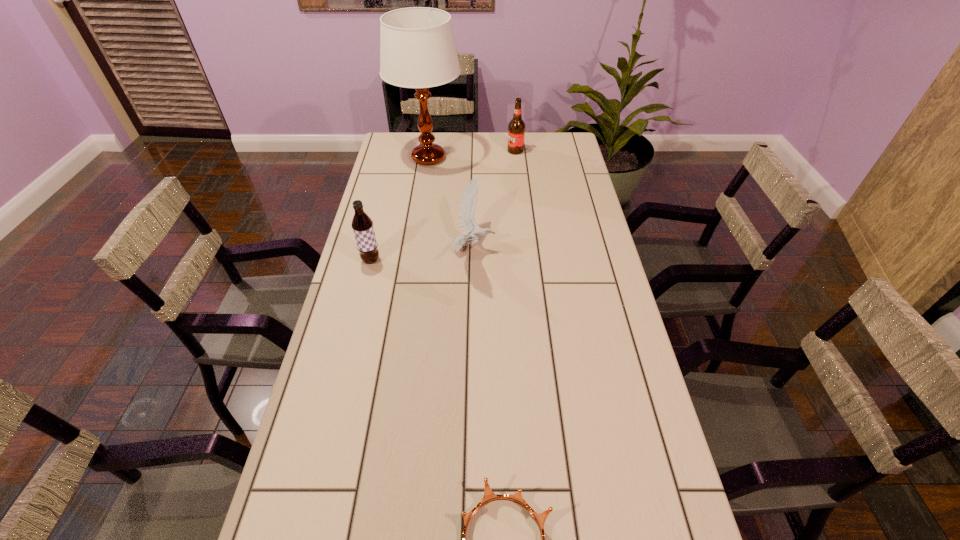
Where is `table lamp`? This screenshot has width=960, height=540. table lamp is located at coordinates (417, 47).

Identify the location of the nearer root beer. This screenshot has width=960, height=540. (x=362, y=224).

Locate an element on the screen. the farther root beer is located at coordinates (516, 129).

Locate an element on the screen. gull is located at coordinates (467, 207).

The width and height of the screenshot is (960, 540). In order to click on blank area located 0.160m on the front of the tallest object in this screenshot , I will do [x=421, y=202].

Where is `free space located on the back of the left root beer`? This screenshot has height=540, width=960. free space located on the back of the left root beer is located at coordinates (375, 241).

Where is `vacant area situated on the left of the farther root beer`? This screenshot has height=540, width=960. vacant area situated on the left of the farther root beer is located at coordinates (489, 151).

Locate an element on the screen. Image resolution: width=960 pixels, height=540 pixels. free region located 0.160m at the tip of the beak of the second shortest object is located at coordinates (543, 249).

Find the location of a particular element. table lamp that is at the far edge is located at coordinates (417, 47).

The height and width of the screenshot is (540, 960). What are the coordinates of `root beer at the far edge` in the screenshot? It's located at (516, 129).